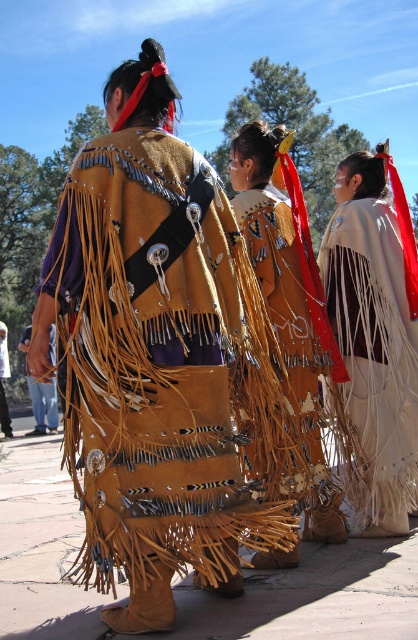
Can you confirm if leather fringe vest at center is shorter than white fringed cape at center?

Indeed, leather fringe vest at center has a lesser height compared to white fringed cape at center.

Measure the distance between leather fringe vest at center and white fringed cape at center.

They are 1.53 meters apart.

Locate an element on the screen. This screenshot has width=418, height=640. leather fringe vest at center is located at coordinates (150, 355).

This screenshot has height=640, width=418. Find the location of `leather fringe vest at center`. leather fringe vest at center is located at coordinates (150, 355).

Is leather fringe vest at center smaller than leather fringe vest at lower left?

Correct, leather fringe vest at center occupies less space than leather fringe vest at lower left.

Is leather fringe vest at center thinner than leather fringe vest at lower left?

Indeed, leather fringe vest at center has a lesser width compared to leather fringe vest at lower left.

Is point (168, 173) positioned in front of point (53, 417)?

That is True.

Find the location of `leather fringe vest at center`. leather fringe vest at center is located at coordinates [x=150, y=355].

Does white fringed cape at center have a smaller size compared to brown suede vest at center?

Yes, white fringed cape at center is smaller than brown suede vest at center.

At what (x,y) coordinates should I click in order to perform the action: click on white fringed cape at center. Please return your answer as a coordinate pair (x, y). The image size is (418, 640). Looking at the image, I should click on (374, 337).

Locate an element on the screen. The width and height of the screenshot is (418, 640). white fringed cape at center is located at coordinates (374, 337).